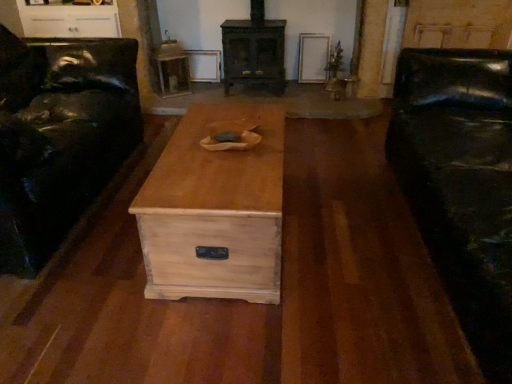
Where is `free space above natural wood chest at center (from a real-world perspective)`? The image size is (512, 384). free space above natural wood chest at center (from a real-world perspective) is located at coordinates (210, 164).